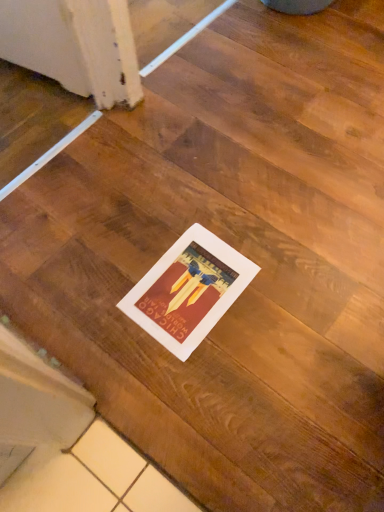
Locate an element on the screen. blank space above matte paper poster at center (from a real-world perspective) is located at coordinates (188, 288).